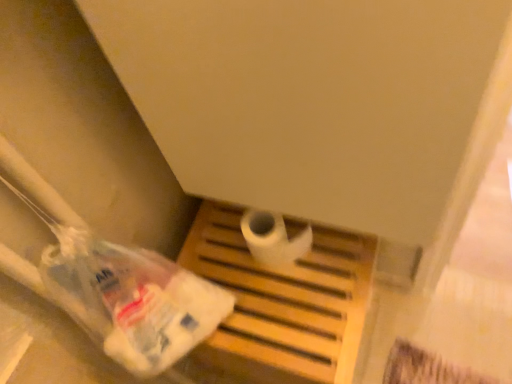
Find the location of a particular element. The height and width of the screenshot is (384, 512). vacant area that lies in front of white matte toilet paper at center is located at coordinates (302, 303).